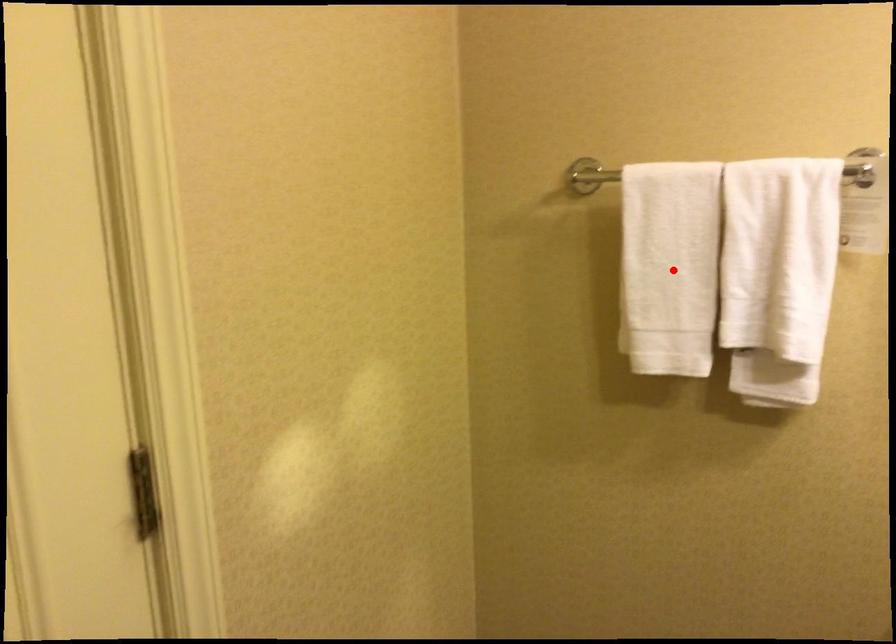
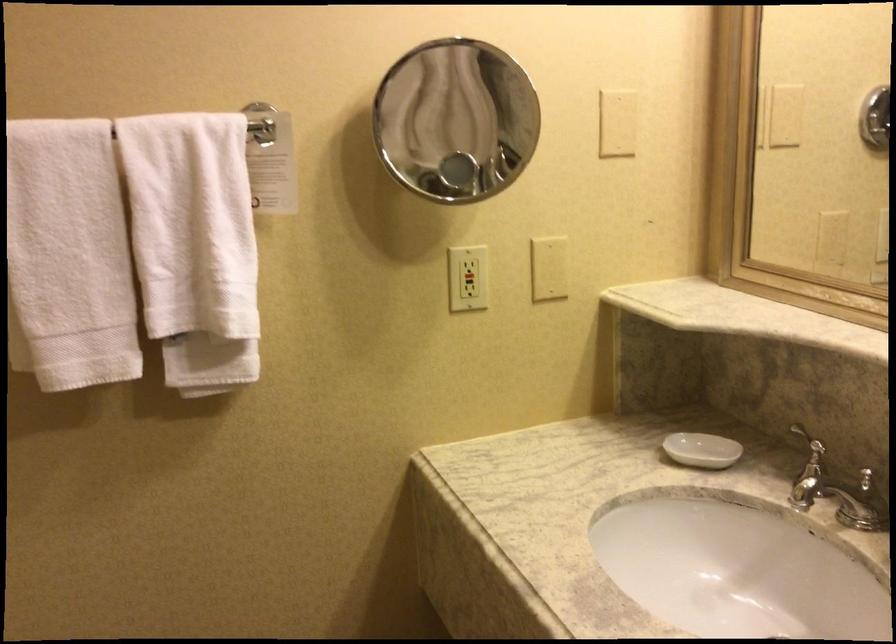
In the second image, find the point that corresponds to the highlighted location in the first image.

(67, 257)